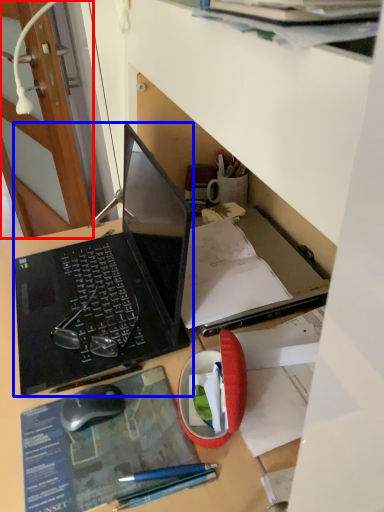
Question: Which object appears farthest to the camera in this image, door (highlighted by a red box) or laptop (highlighted by a blue box)?

Choices:
 (A) door
 (B) laptop

Answer: (A)